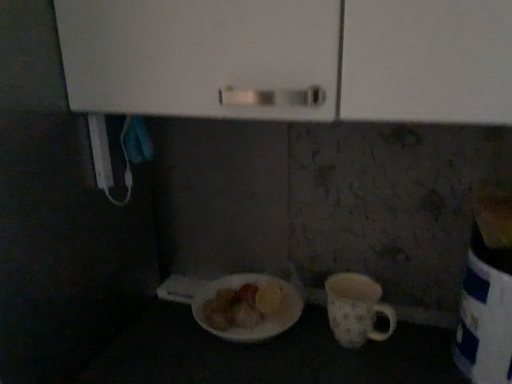
Measure the distance between point [348,328] and camera.

Point [348,328] and camera are 31.97 inches apart.

Where is `porcelain textured mug at lower right`? porcelain textured mug at lower right is located at coordinates (356, 309).

Describe the element at coordinates (356, 309) in the screenshot. I see `porcelain textured mug at lower right` at that location.

The width and height of the screenshot is (512, 384). In order to click on porcelain textured mug at lower right in this screenshot , I will do `click(356, 309)`.